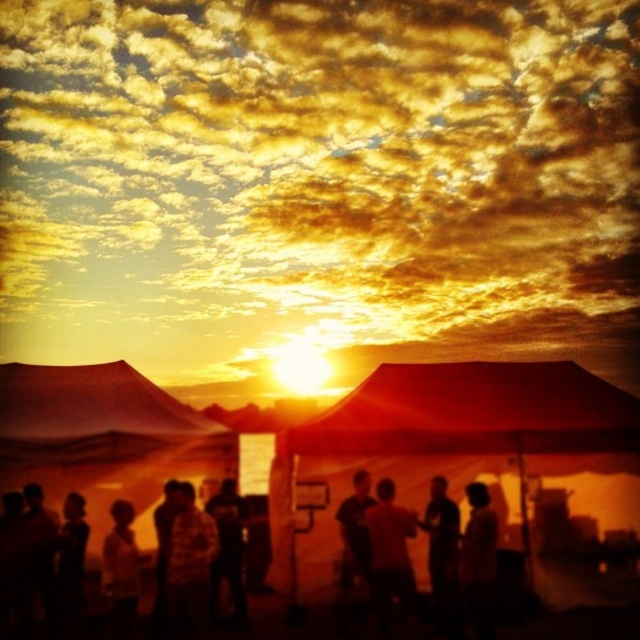
Question: Can you confirm if golden textured clouds at upper center is bigger than silhouette casual attire at center?

Choices:
 (A) no
 (B) yes

Answer: (B)

Question: Among these objects, which one is farthest from the camera?

Choices:
 (A) silky black shirt at lower right
 (B) silhouette shirt at lower left

Answer: (A)

Question: Does silky black shirt at lower right have a larger size compared to silhouette shirt at lower left?

Choices:
 (A) yes
 (B) no

Answer: (A)

Question: Estimate the real-world distances between objects in this image. Which object is farther from the silhouette casual attire at center?

Choices:
 (A) silhouette shirt at lower left
 (B) dark fabric shirt at center
 (C) golden textured clouds at upper center

Answer: (C)

Question: Is flannel shirt at center to the left of silhouette shirt at lower left from the viewer's perspective?

Choices:
 (A) no
 (B) yes

Answer: (A)

Question: Which object is the farthest from the dark textured shirt at center?

Choices:
 (A) flannel shirt at center
 (B) golden textured clouds at upper center

Answer: (B)